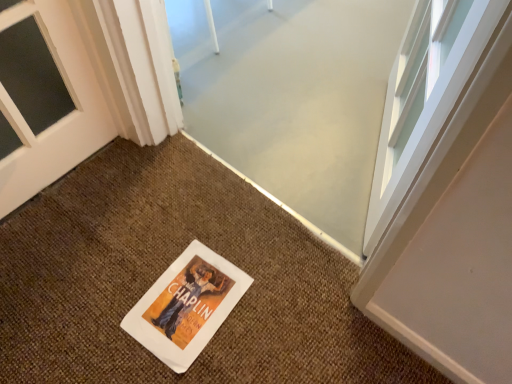
Question: From the image's perspective, is white paper doormat at center on top of white paper flyer at center?

Choices:
 (A) yes
 (B) no

Answer: (B)

Question: Is white paper doormat at center positioned beyond the bounds of white paper flyer at center?

Choices:
 (A) yes
 (B) no

Answer: (A)

Question: Is white paper doormat at center aimed at white paper flyer at center?

Choices:
 (A) no
 (B) yes

Answer: (B)

Question: Could white paper flyer at center be considered to be inside white paper doormat at center?

Choices:
 (A) no
 (B) yes

Answer: (B)

Question: Considering the relative sizes of white paper doormat at center and white paper flyer at center in the image provided, is white paper doormat at center shorter than white paper flyer at center?

Choices:
 (A) no
 (B) yes

Answer: (A)

Question: Can you confirm if white paper doormat at center is bigger than white paper flyer at center?

Choices:
 (A) yes
 (B) no

Answer: (A)

Question: Is white paper flyer at center beside white paper doormat at center?

Choices:
 (A) no
 (B) yes

Answer: (A)

Question: Does white paper flyer at center have a greater width compared to white paper doormat at center?

Choices:
 (A) no
 (B) yes

Answer: (A)

Question: Is white paper doormat at center surrounded by white paper flyer at center?

Choices:
 (A) yes
 (B) no

Answer: (B)

Question: Is white paper flyer at center bigger than white paper doormat at center?

Choices:
 (A) no
 (B) yes

Answer: (A)

Question: From the image's perspective, is white paper flyer at center located above white paper doormat at center?

Choices:
 (A) no
 (B) yes

Answer: (B)

Question: Considering the relative sizes of white paper flyer at center and white paper doormat at center in the image provided, is white paper flyer at center taller than white paper doormat at center?

Choices:
 (A) no
 (B) yes

Answer: (A)

Question: From a real-world perspective, is white paper flyer at center positioned above or below white paper doormat at center?

Choices:
 (A) below
 (B) above

Answer: (B)